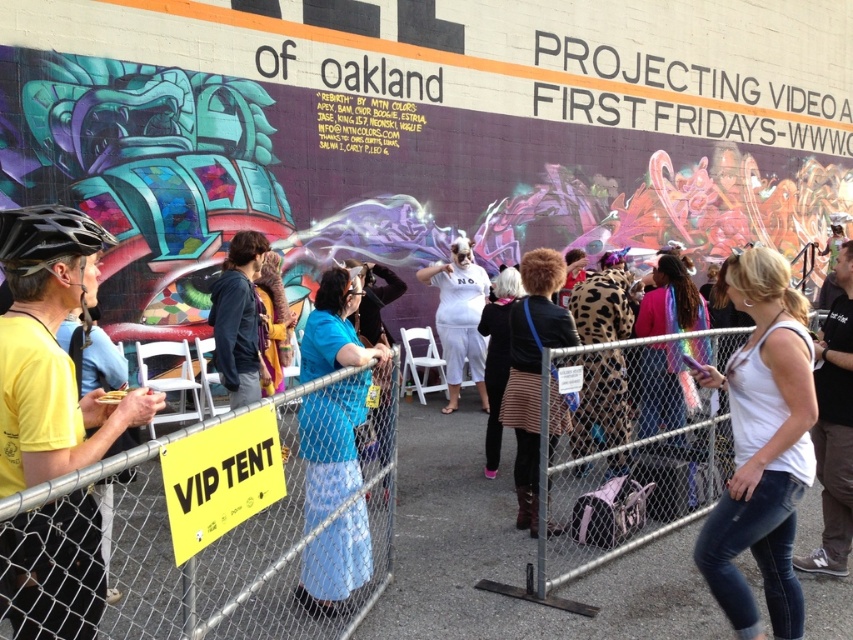
Question: Which point appears farthest from the camera in this image?

Choices:
 (A) (828, 396)
 (B) (210, 307)
 (C) (579, 323)

Answer: (B)

Question: Estimate the real-world distances between objects in this image. Which object is farther from the dark blue hoodie at center?

Choices:
 (A) blue fabric skirt at center
 (B) white matte tank top at center
 (C) leather jacket at center
 (D) metal mesh fence at center

Answer: (B)

Question: From the image, what is the correct spatial relationship of dark blue hoodie at center in relation to black matte bicycle helmet at left?

Choices:
 (A) above
 (B) below

Answer: (B)

Question: Which of the following is the closest to the observer?

Choices:
 (A) (639, 356)
 (B) (453, 316)
 (C) (341, 544)
 (D) (578, 324)

Answer: (C)

Question: Can you confirm if white matte tank top at center is bigger than white tank top at center?

Choices:
 (A) no
 (B) yes

Answer: (A)

Question: Can you confirm if blue fabric skirt at center is positioned below black matte bicycle helmet at left?

Choices:
 (A) yes
 (B) no

Answer: (A)